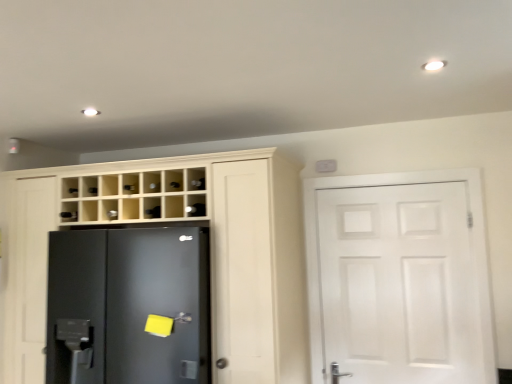
Question: Based on their sizes in the image, would you say matte wood cupboard at center is bigger or smaller than satin nickel door handle at lower center?

Choices:
 (A) small
 (B) big

Answer: (B)

Question: Considering their positions, is matte wood cupboard at center located in front of or behind satin nickel door handle at lower center?

Choices:
 (A) front
 (B) behind

Answer: (A)

Question: Which of these objects is positioned closest to the black matte refrigerator at left?

Choices:
 (A) satin nickel door handle at lower center
 (B) white matte door at right
 (C) matte wood cupboard at center
 (D) black glass shelf at upper center

Answer: (C)

Question: Estimate the real-world distances between objects in this image. Which object is closer to the satin nickel door handle at lower center?

Choices:
 (A) black glass shelf at upper center
 (B) black matte refrigerator at left
 (C) white matte door at right
 (D) matte wood cupboard at center

Answer: (B)